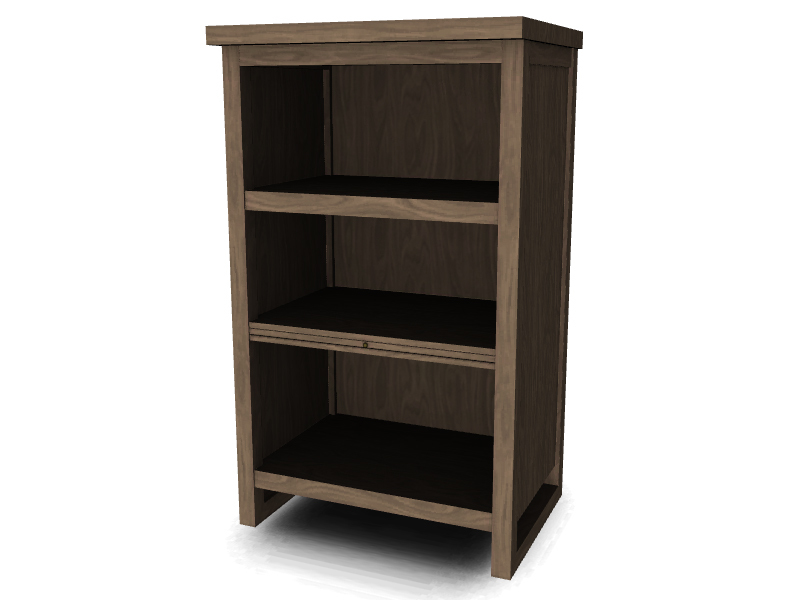
Locate an element on the screen. The width and height of the screenshot is (800, 600). brown side panel is located at coordinates (560, 91).